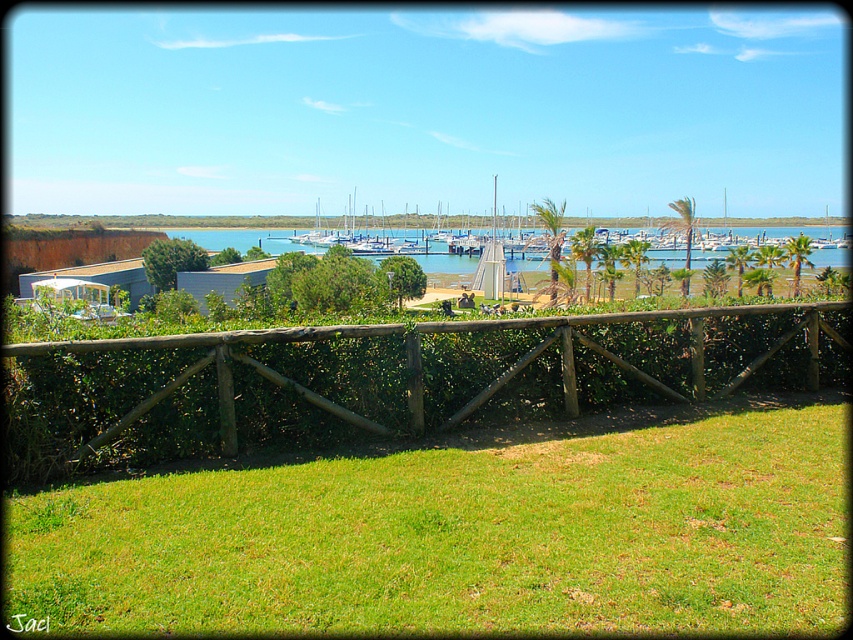
Which is more to the right, brown wooden fence at center or green leafy hedge at center?

brown wooden fence at center is more to the right.

Is brown wooden fence at center to the left of green leafy hedge at center from the viewer's perspective?

No, brown wooden fence at center is not to the left of green leafy hedge at center.

The width and height of the screenshot is (853, 640). Describe the element at coordinates (390, 374) in the screenshot. I see `brown wooden fence at center` at that location.

This screenshot has height=640, width=853. Find the location of `brown wooden fence at center`. brown wooden fence at center is located at coordinates (390, 374).

Based on the photo, does green grass at lower center have a larger size compared to green leafy hedge at center?

Incorrect, green grass at lower center is not larger than green leafy hedge at center.

Can you confirm if green grass at lower center is positioned to the right of green leafy hedge at center?

Yes, green grass at lower center is to the right of green leafy hedge at center.

Identify the location of green grass at lower center. The height and width of the screenshot is (640, 853). (462, 538).

Who is positioned more to the right, green grass at lower center or brown wooden fence at center?

From the viewer's perspective, green grass at lower center appears more on the right side.

Locate an element on the screen. The width and height of the screenshot is (853, 640). green grass at lower center is located at coordinates pos(462,538).

Is point (821, 520) positioned after point (611, 333)?

No, (821, 520) is in front of (611, 333).

At what (x,y) coordinates should I click in order to perform the action: click on green grass at lower center. Please return your answer as a coordinate pair (x, y). Looking at the image, I should click on (462, 538).